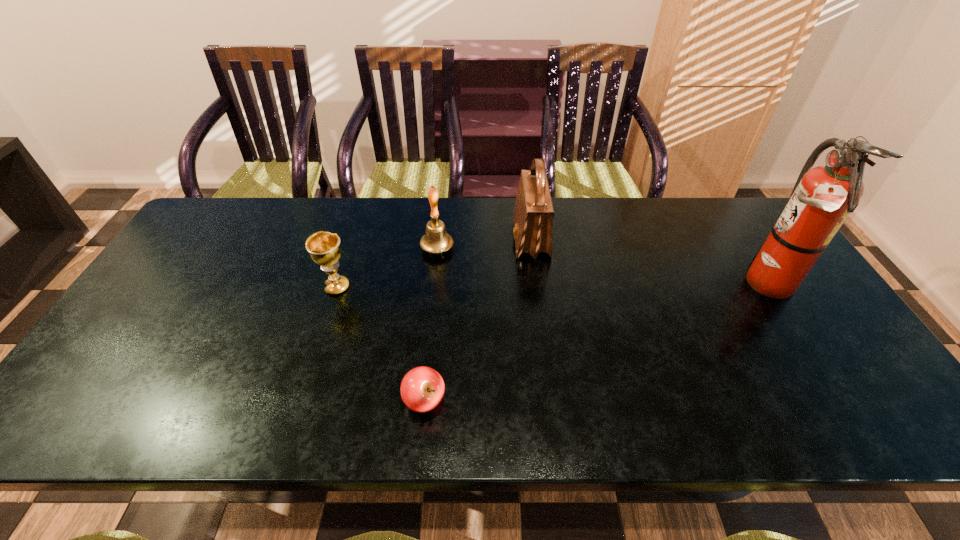
This screenshot has height=540, width=960. What are the coordinates of `free space in the image that satisfies the following two spatial constraints: 1. on the front flap of the fourth shortest object; 2. on the front side of the nearest object` in the screenshot? It's located at [551, 401].

You are a GUI agent. You are given a task and a screenshot of the screen. Output one action in this format:
    pyautogui.click(x=<x>, y=<y>)
    Task: Click on the vacant point that satisfies the following two spatial constraints: 1. on the front side of the chalice; 2. on the right side of the shortest object
    The width and height of the screenshot is (960, 540).
    Given the screenshot: What is the action you would take?
    pyautogui.click(x=301, y=401)

Image resolution: width=960 pixels, height=540 pixels. Identify the location of free point that satisfies the following two spatial constraints: 1. on the front flap of the fourth object from left to right; 2. on the front side of the bell. (532, 249).